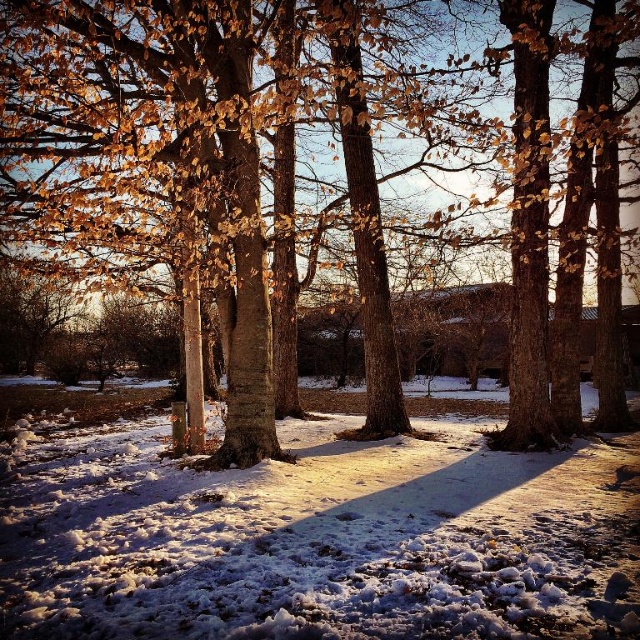
Question: Which point is closer to the camera?

Choices:
 (A) (108, 547)
 (B) (445, 163)

Answer: (A)

Question: Does brown textured bark at center lie behind white fluffy snow at center?

Choices:
 (A) yes
 (B) no

Answer: (A)

Question: Can you confirm if brown textured bark at center is bigger than white fluffy snow at center?

Choices:
 (A) no
 (B) yes

Answer: (B)

Question: Can you confirm if brown textured bark at center is wider than white fluffy snow at center?

Choices:
 (A) yes
 (B) no

Answer: (A)

Question: Which object appears farthest from the camera in this image?

Choices:
 (A) brown textured bark at center
 (B) white fluffy snow at center

Answer: (A)